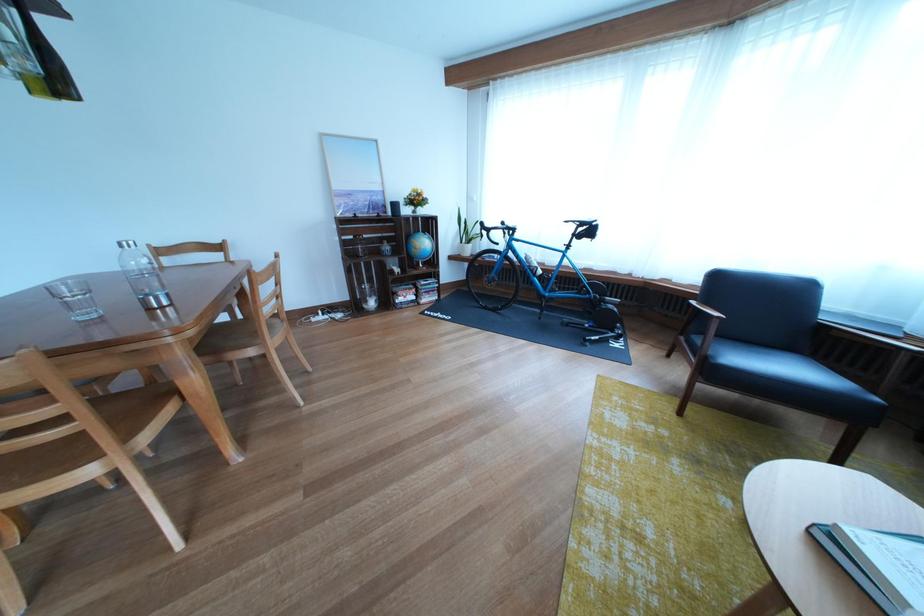
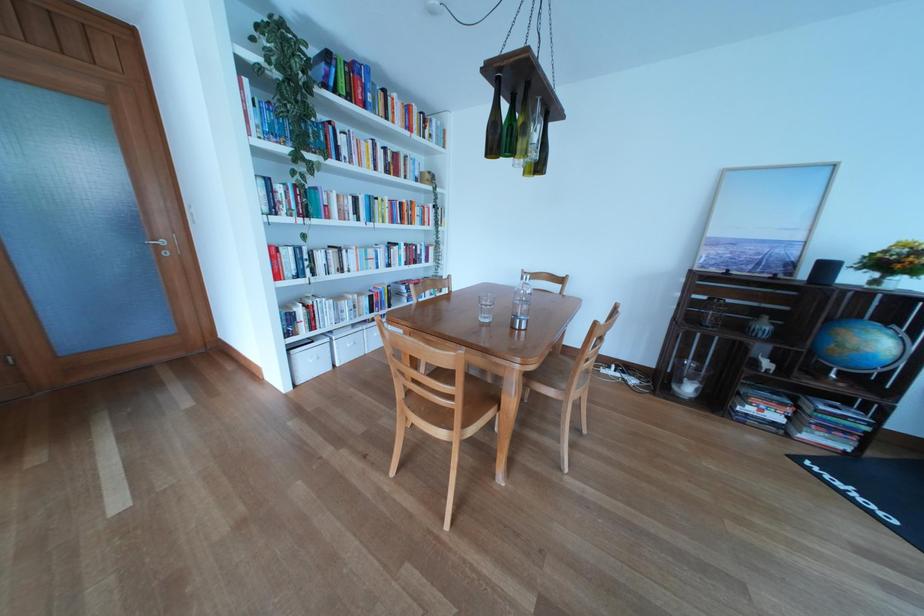
The point at [403,217] is marked in the first image. Where is the corresponding point in the second image?

(816, 282)